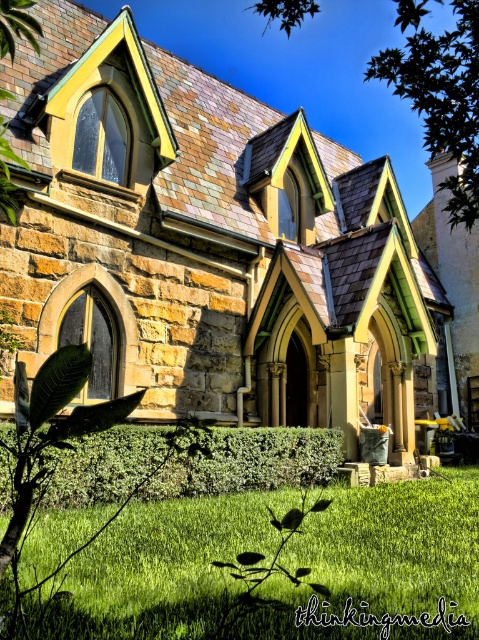
You are standing in front of the brown stone church at center. If you want to take a photo of the entire building without any part being cut off, what is the minimum distance you should stand from the church?

To capture the entire brown stone church at center in the photo without any part being cut off, you should stand at least 8.12 meters away from it, as this is the distance between the camera and the church.

You are standing in front of the brown stone church at center and looking up. Is there a green leafy tree at upper center above you?

Yes, the brown stone church at center is positioned under the green leafy tree at upper center, so when looking up, the green leafy tree at upper center is directly above the church.